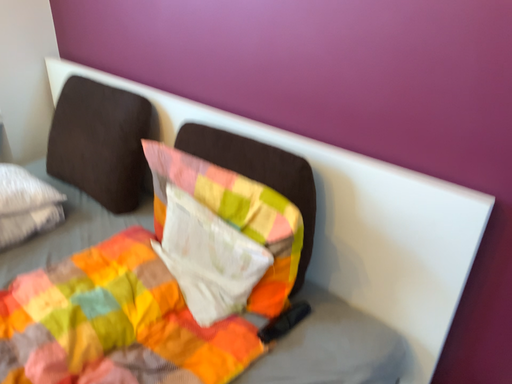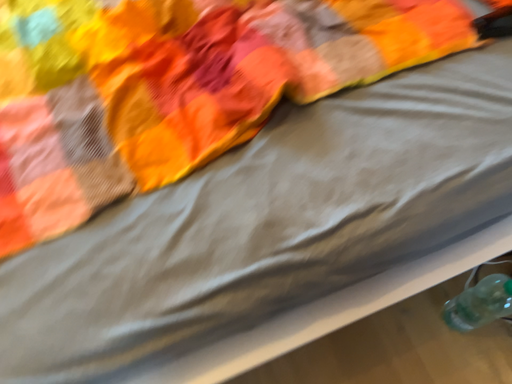
Question: How did the camera likely rotate when shooting the video?

Choices:
 (A) rotated left
 (B) rotated right

Answer: (A)